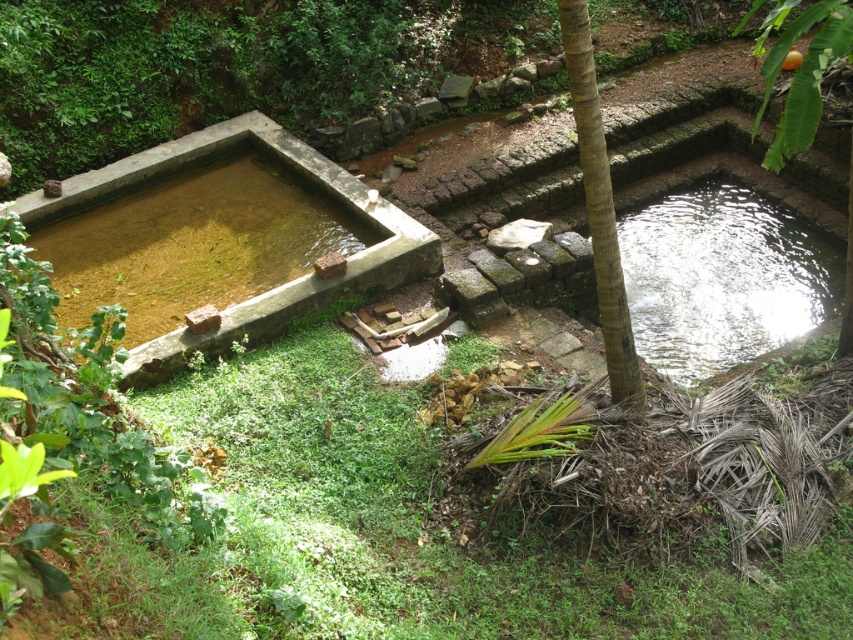
Who is shorter, green grass at center or brown rough tree trunk at center?

green grass at center is shorter.

Who is lower down, green grass at center or brown rough tree trunk at center?

green grass at center is lower down.

Is point (227, 580) positioned behind point (595, 244)?

No.

At what (x,y) coordinates should I click in order to perform the action: click on green grass at center. Please return your answer as a coordinate pair (x, y). Looking at the image, I should click on (419, 528).